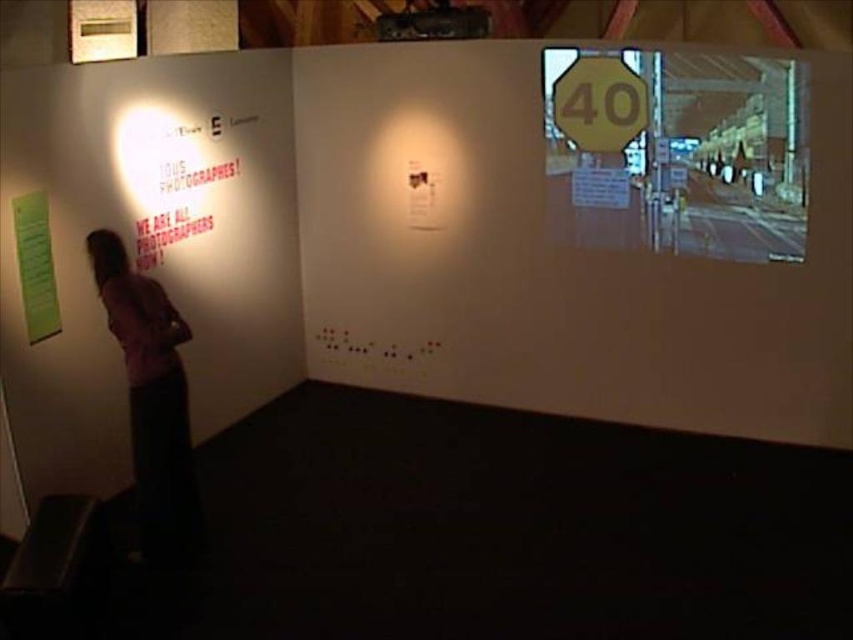
Is pink fabric at left to the right of green paper at left from the viewer's perspective?

Correct, you'll find pink fabric at left to the right of green paper at left.

Is point (169, 365) farther from camera compared to point (16, 241)?

No.

Does point (120, 276) come closer to viewer compared to point (28, 250)?

Yes, point (120, 276) is closer to viewer.

Locate an element on the screen. pink fabric at left is located at coordinates (151, 397).

How much distance is there between yellow reflective sign at upper right and green paper at left?

3.89 meters

Can you confirm if yellow reflective sign at upper right is bigger than green paper at left?

Correct, yellow reflective sign at upper right is larger in size than green paper at left.

Is point (659, 209) positioned in front of point (33, 243)?

No, it is behind (33, 243).

This screenshot has width=853, height=640. I want to click on yellow reflective sign at upper right, so click(677, 150).

Between yellow reflective sign at upper right and yellow matte sign at upper right, which one has more height?

Standing taller between the two is yellow reflective sign at upper right.

Can you confirm if yellow reflective sign at upper right is taller than yellow matte sign at upper right?

Yes, yellow reflective sign at upper right is taller than yellow matte sign at upper right.

Between point (770, 161) and point (622, 147), which one is positioned behind?

Positioned behind is point (622, 147).

Where is `yellow reflective sign at upper right`? The height and width of the screenshot is (640, 853). yellow reflective sign at upper right is located at coordinates (677, 150).